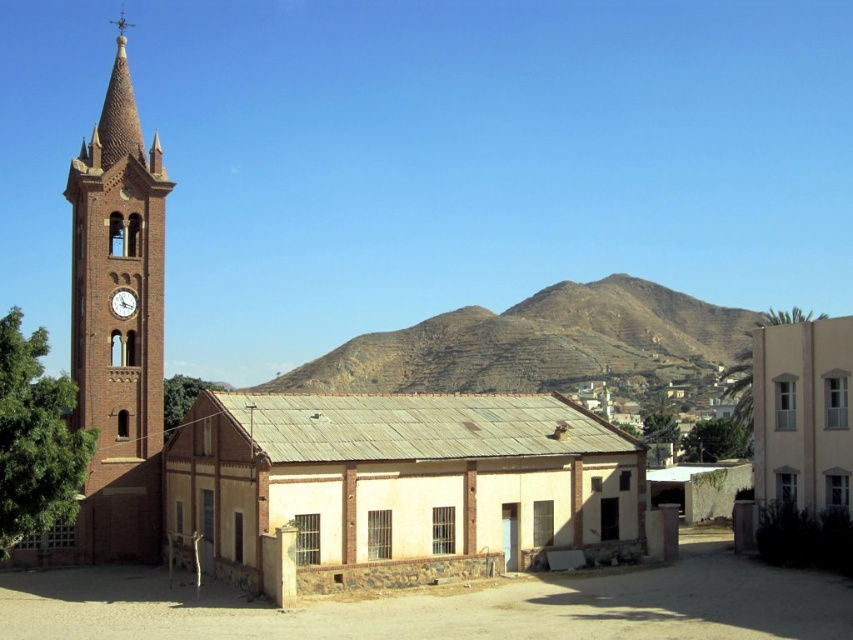
Question: Is brown rocky mountain at center to the right of matte brown clock at left from the viewer's perspective?

Choices:
 (A) no
 (B) yes

Answer: (B)

Question: Estimate the real-world distances between objects in this image. Which object is closer to the beige stucco building at right?

Choices:
 (A) brown rocky mountain at center
 (B) matte brown clock at left
 (C) light beige brick building at center

Answer: (C)

Question: Among these points, which one is farthest from the camera?

Choices:
 (A) (531, 337)
 (B) (842, 362)
 (C) (326, 396)
 (D) (129, 298)

Answer: (A)

Question: Which point appears farthest from the camera in this image?

Choices:
 (A) (131, 301)
 (B) (442, 342)

Answer: (B)

Question: Does brick clock tower at left have a lesser width compared to matte brown clock at left?

Choices:
 (A) yes
 (B) no

Answer: (B)

Question: Is brown rocky mountain at center wider than matte brown clock at left?

Choices:
 (A) no
 (B) yes

Answer: (B)